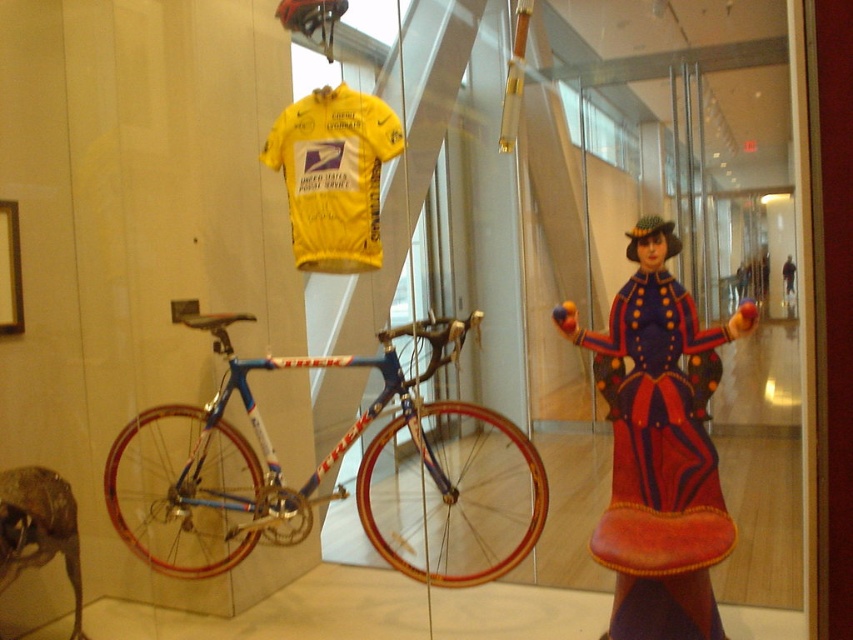
Question: Can you confirm if metallic bicycle at center is positioned to the left of blue metallic bicycle at center?

Choices:
 (A) yes
 (B) no

Answer: (B)

Question: Which of the following is the closest to the observer?

Choices:
 (A) metallic bicycle at center
 (B) blue metallic bicycle at center

Answer: (B)

Question: Which point is farther to the camera?

Choices:
 (A) velvet-like red dress at right
 (B) blue metallic bicycle at center

Answer: (B)

Question: Does blue metallic bicycle at center appear on the right side of velvet-like red dress at right?

Choices:
 (A) yes
 (B) no

Answer: (B)

Question: Is blue metallic bicycle at center closer to camera compared to velvet-like red dress at right?

Choices:
 (A) yes
 (B) no

Answer: (B)

Question: Which object appears closest to the camera in this image?

Choices:
 (A) blue metallic bicycle at center
 (B) velvet-like red dress at right

Answer: (B)